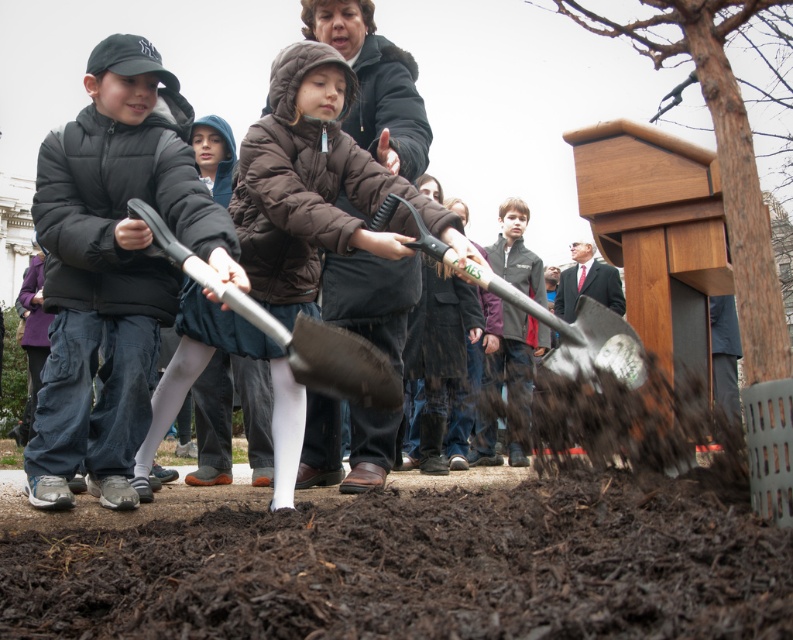
Question: Which point is closer to the camera taking this photo?

Choices:
 (A) (307, 376)
 (B) (272, 572)

Answer: (B)

Question: Among these points, which one is nearest to the camera?

Choices:
 (A) (496, 275)
 (B) (54, 131)

Answer: (B)

Question: Does brown fuzzy jacket at center appear on the left side of silver metallic shovel at center?

Choices:
 (A) yes
 (B) no

Answer: (B)

Question: Estimate the real-world distances between objects in this image. Which object is closer to the dark brown mulch at lower center?

Choices:
 (A) metallic silver shovel at center
 (B) matte black jacket at left
 (C) silver metallic shovel at center
 (D) brown fuzzy jacket at center

Answer: (C)

Question: Is the position of silver metallic shovel at center less distant than that of metallic silver shovel at center?

Choices:
 (A) yes
 (B) no

Answer: (A)

Question: Is dark brown mulch at lower center to the right of metallic silver shovel at center from the viewer's perspective?

Choices:
 (A) yes
 (B) no

Answer: (B)